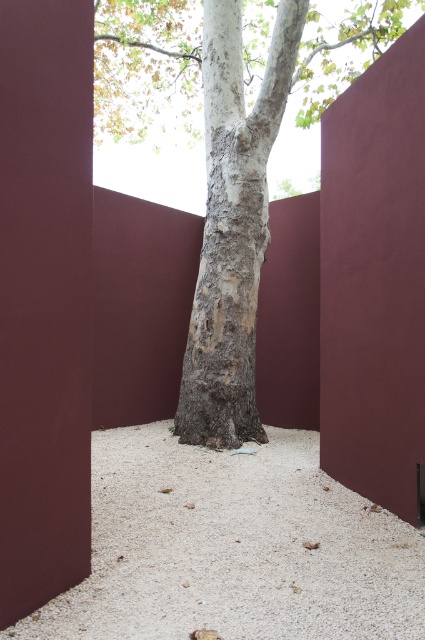
From the picture: You are standing in the enclosed maroon walled area and want to walk from the white gravel at center to the smooth bark tree at center. Which direction should you move?

The white gravel at center is to the left of the smooth bark tree at center, so you should move to the right to reach the smooth bark tree at center.

You are standing in the enclosed space surrounded by maroon walls and looking at the tree at center. Which part of the tree, the gray textured bark at center or the smooth bark tree at center, is nearer to your eyes?

The gray textured bark at center is closer to the viewer than the smooth bark tree at center, so the gray textured bark at center is nearer to your eyes.

You are a gardener planning to plant a new flower bed between the white gravel at center and the smooth bark tree at center. Based on their positions, where should you place the flower bed so it is between both objects?

The flower bed should be placed between the white gravel at center and the smooth bark tree at center, positioned below the tree and above the gravel since the white gravel at center is below the smooth bark tree at center.